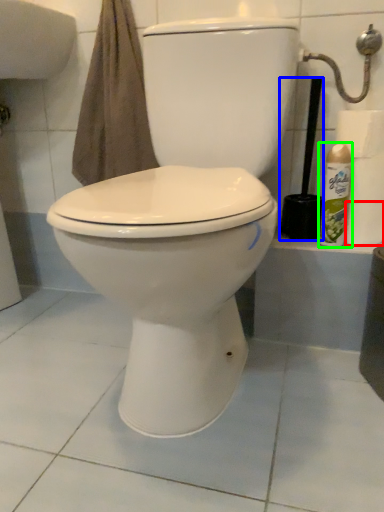
Question: Based on their relative distances, which object is farther from toilet paper (highlighted by a red box)? Choose from brush (highlighted by a blue box) and cleaning product (highlighted by a green box).

Choices:
 (A) brush
 (B) cleaning product

Answer: (A)